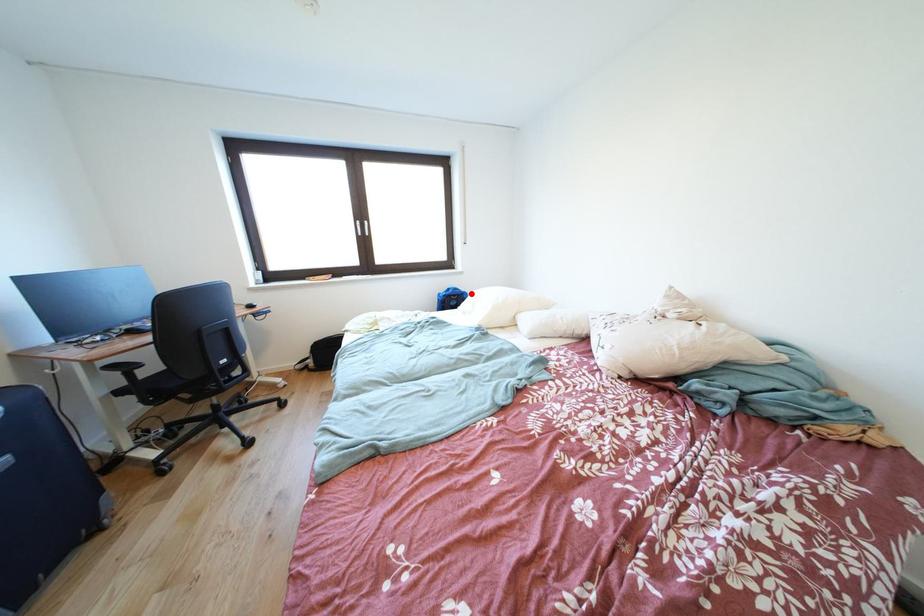
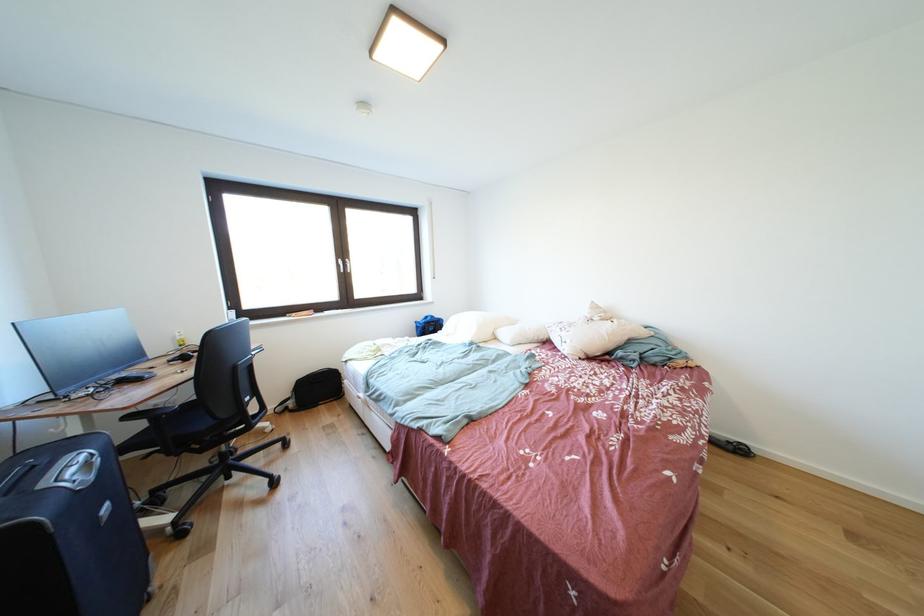
In the second image, find the point that corresponds to the highlighted location in the first image.

(445, 321)